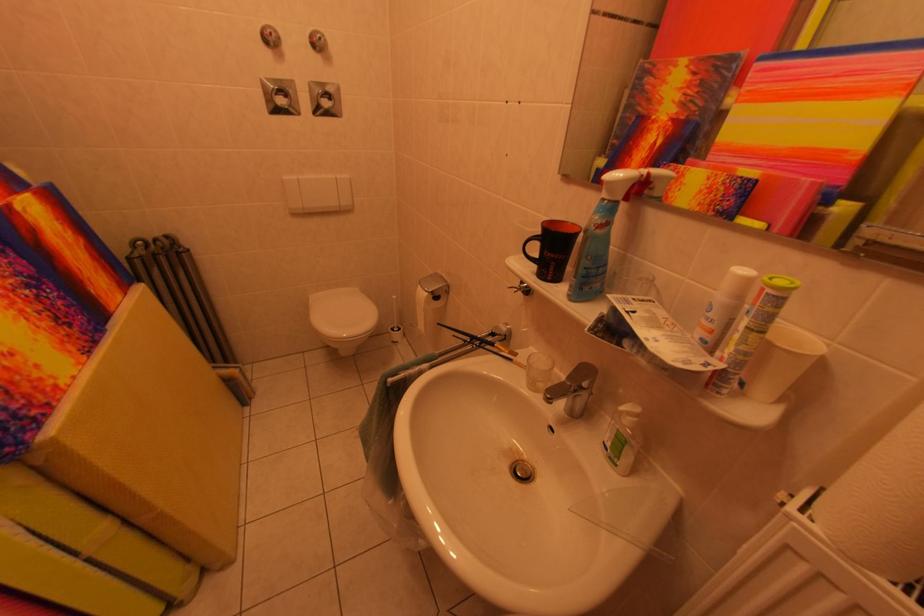
I want to click on sink faucet handle, so click(x=570, y=390).